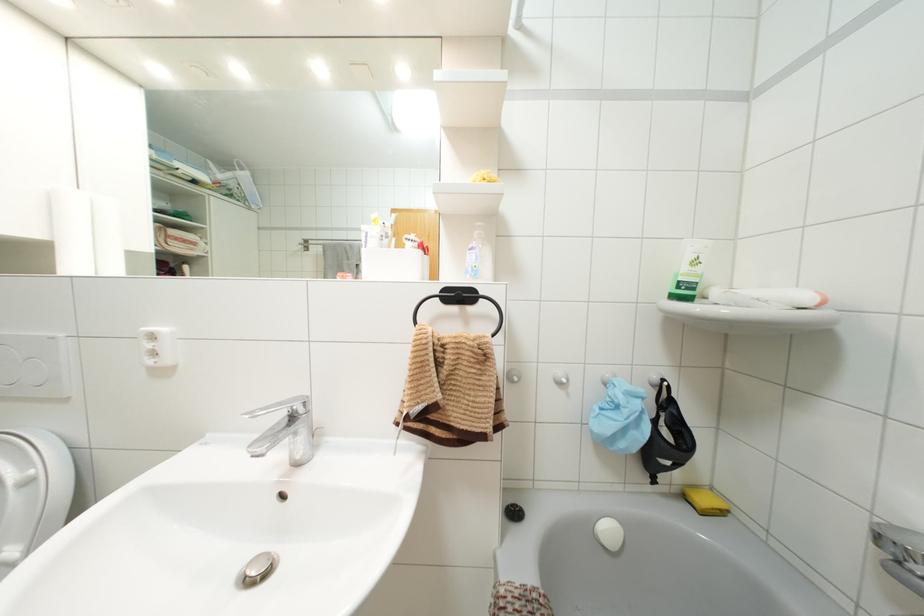
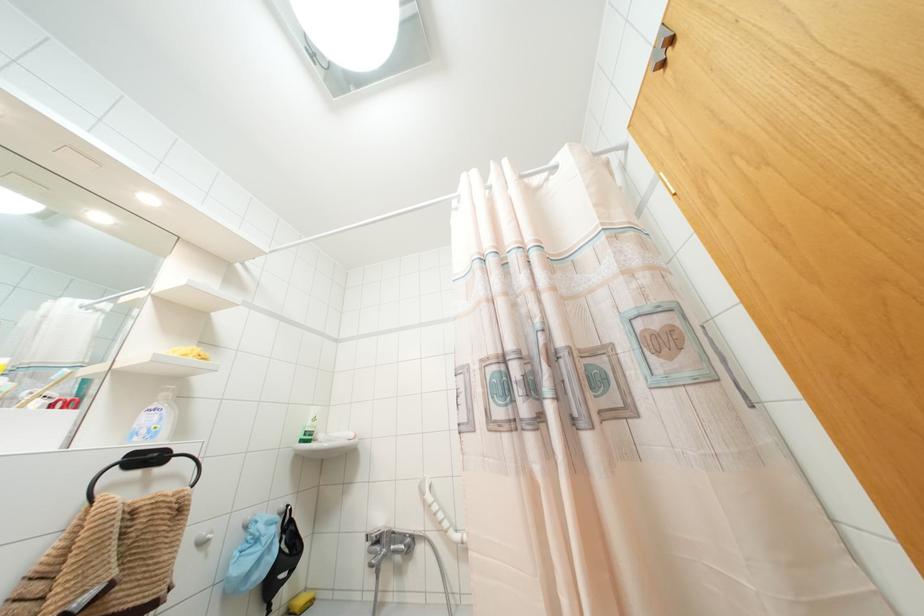
In the second image, find the point that corresponds to (x=695, y=262) in the first image.

(312, 419)